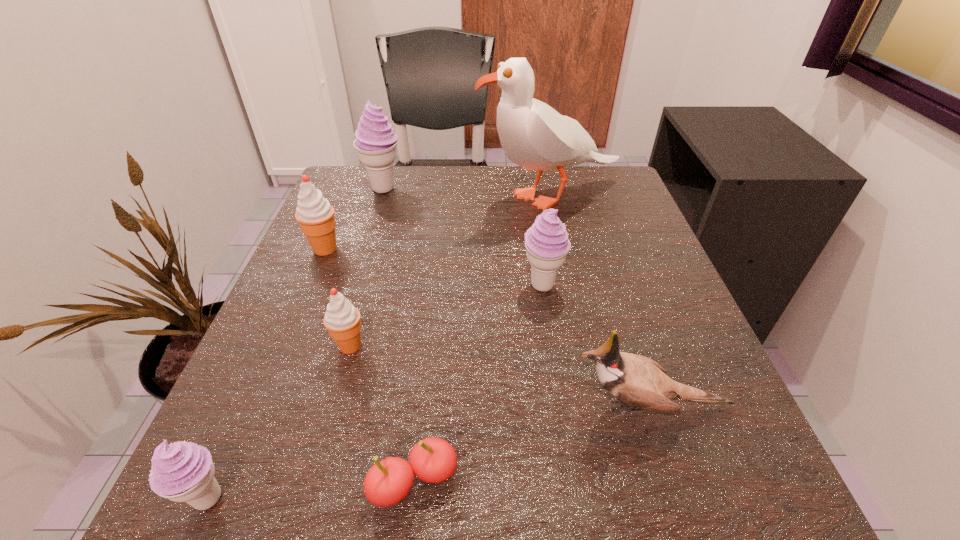
This screenshot has width=960, height=540. What are the coordinates of `vacant space that's between the gull and the leftmost purple icecream` in the screenshot? It's located at (379, 348).

Where is `object that is the third closest one to the left red icecream`? This screenshot has height=540, width=960. object that is the third closest one to the left red icecream is located at coordinates (533, 135).

Locate an element on the screen. the sixth closest object to the tallest icecream is located at coordinates [433, 460].

Identify which icecream is the fourth closest to the second smallest purple icecream. Please provide its 2D coordinates. Your answer should be formatted as a tuple, i.e. [(x, y)], where the tuple contains the x and y coordinates of a point satisfying the conditions above.

[(182, 471)]

The height and width of the screenshot is (540, 960). What are the coordinates of `icecream that is the closest one to the red cherry` in the screenshot? It's located at (342, 319).

Identify the location of purple icecream that stands as the second closest to the fifth object from left to right. (546, 242).

Identify the location of the third closest purple icecream relative to the second nearest icecream. (376, 142).

I want to click on free point that satisfies the following two spatial constraints: 1. at the beak of the gull; 2. on the front side of the rightmost purple icecream, so click(568, 286).

This screenshot has width=960, height=540. I want to click on free space that satisfies the following two spatial constraints: 1. on the front side of the farther red icecream; 2. on the right side of the shortest object, so click(228, 482).

Where is `vacant space that satisfies the following two spatial constraints: 1. at the beak of the tallest object; 2. on the front side of the rightmost icecream`? This screenshot has width=960, height=540. vacant space that satisfies the following two spatial constraints: 1. at the beak of the tallest object; 2. on the front side of the rightmost icecream is located at coordinates (568, 286).